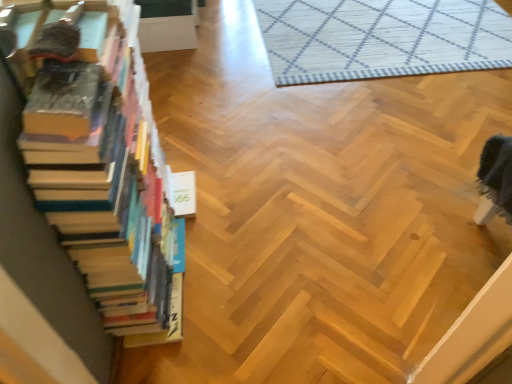
Describe the element at coordinates (100, 160) in the screenshot. I see `wooden books at left` at that location.

From the picture: In order to face wooden books at left, should I rotate leftwards or rightwards?

A 15.085 degree turn to the left will do.

You are a GUI agent. You are given a task and a screenshot of the screen. Output one action in this format:
    pyautogui.click(x=<x>, y=<y>)
    Task: Click on the wooden books at left
    The width and height of the screenshot is (512, 384).
    Given the screenshot: What is the action you would take?
    pyautogui.click(x=100, y=160)

Where is `wooden books at left`? This screenshot has width=512, height=384. wooden books at left is located at coordinates (100, 160).